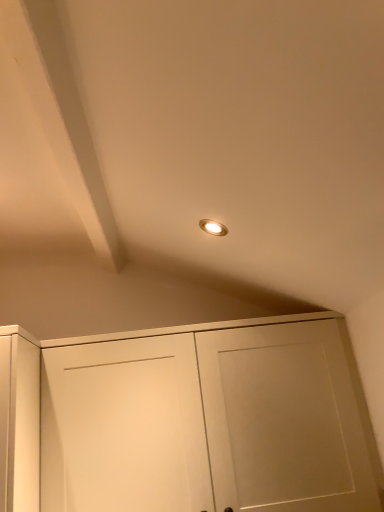
Question: Do you think white matte cabinet at center is within matte white exhaust hood at upper left, or outside of it?

Choices:
 (A) inside
 (B) outside

Answer: (B)

Question: Based on their sizes in the image, would you say white matte cabinet at center is bigger or smaller than matte white exhaust hood at upper left?

Choices:
 (A) big
 (B) small

Answer: (A)

Question: From a real-world perspective, is white matte cabinet at center positioned above or below matte white exhaust hood at upper left?

Choices:
 (A) below
 (B) above

Answer: (A)

Question: Which is correct: matte white exhaust hood at upper left is inside white matte cabinet at center, or outside of it?

Choices:
 (A) inside
 (B) outside

Answer: (B)

Question: Looking at the image, does matte white exhaust hood at upper left seem bigger or smaller compared to white matte cabinet at center?

Choices:
 (A) small
 (B) big

Answer: (A)

Question: From their relative heights in the image, would you say matte white exhaust hood at upper left is taller or shorter than white matte cabinet at center?

Choices:
 (A) short
 (B) tall

Answer: (A)

Question: Considering the positions of point (26, 81) and point (251, 462), is point (26, 81) closer or farther from the camera than point (251, 462)?

Choices:
 (A) farther
 (B) closer

Answer: (B)